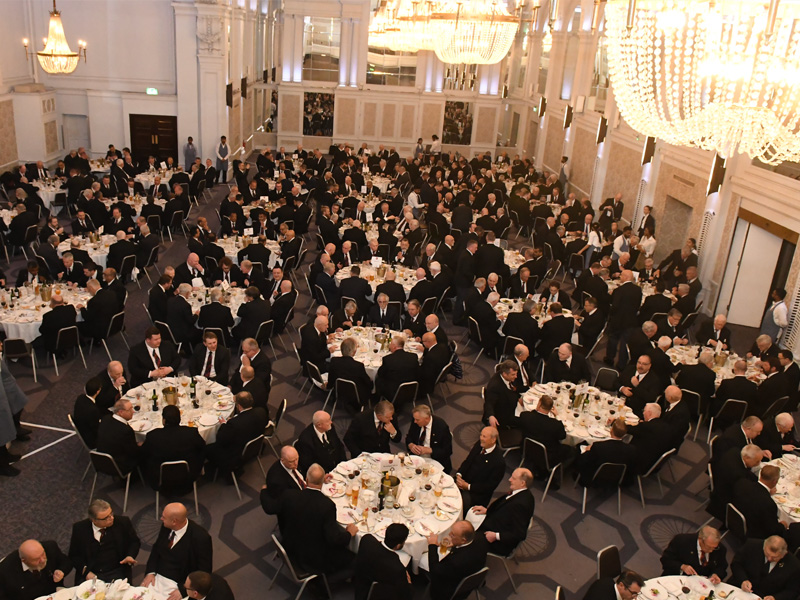
Find the location of `lintel`. lintel is located at coordinates (762, 224).